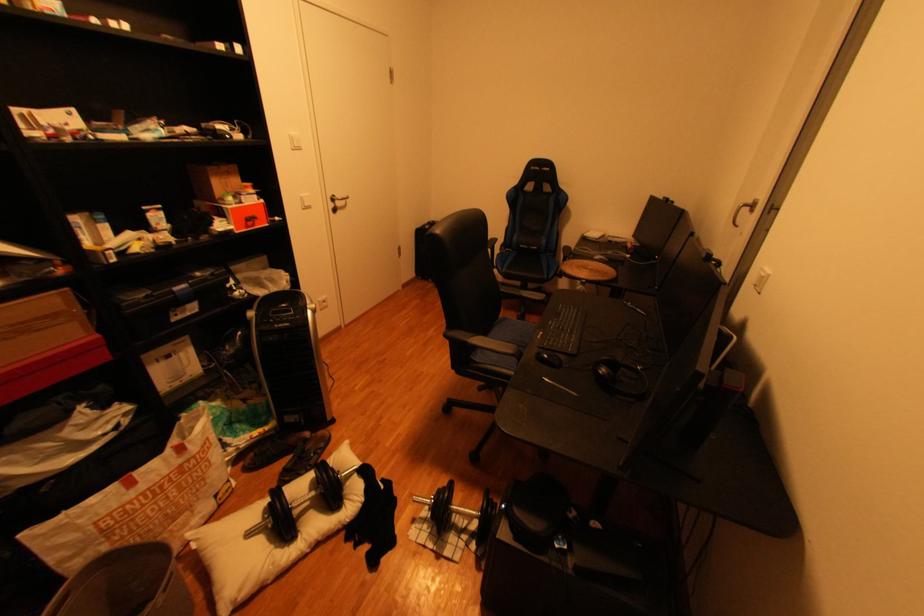
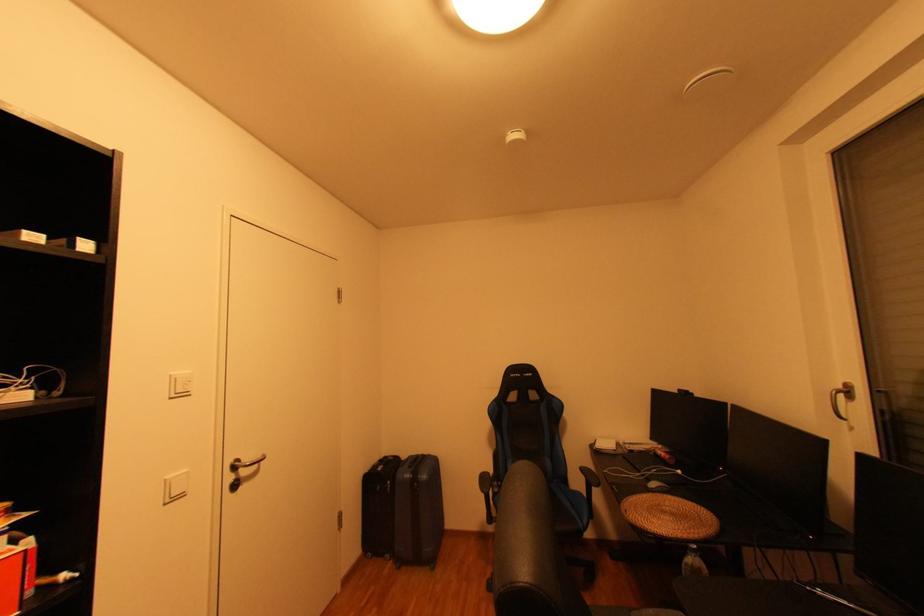
The point at (596, 236) is marked in the first image. Where is the corresponding point in the second image?

(606, 448)